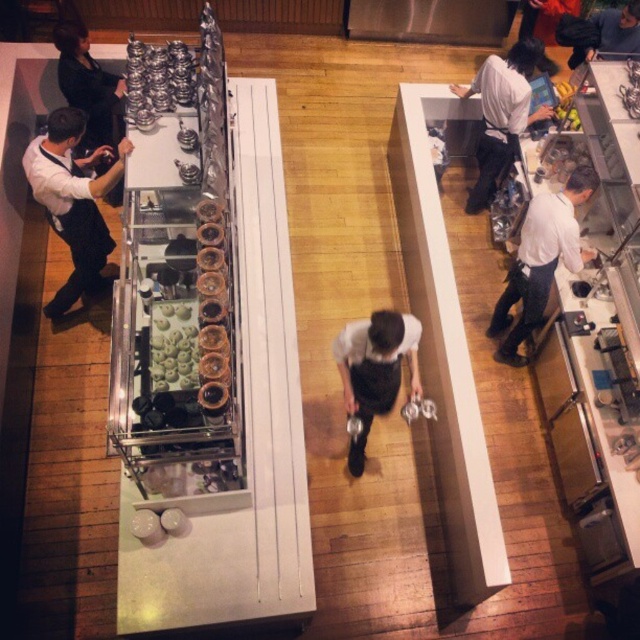
Does point (566, 259) come behind point (529, 61)?

No, (566, 259) is closer to viewer.

Is white shirt at right taller than white apron at right?

Yes, white shirt at right is taller than white apron at right.

Who is more distant from viewer, (531, 230) or (488, 80)?

The point (488, 80) is more distant.

You are a GUI agent. You are given a task and a screenshot of the screen. Output one action in this format:
    pyautogui.click(x=<x>, y=<y>)
    Task: Click on the white shirt at right
    The image size is (640, 640).
    Given the screenshot: What is the action you would take?
    pyautogui.click(x=540, y=260)

Can you confirm if white shirt at right is bigger than dark blue sweater at upper right?

Yes.

Does white shirt at right appear under dark blue sweater at upper right?

Yes.

Is point (529, 225) positioned in front of point (589, 29)?

Yes, point (529, 225) is closer to viewer.

You are a GUI agent. You are given a task and a screenshot of the screen. Output one action in this format:
    pyautogui.click(x=<x>, y=<y>)
    Task: Click on the white shirt at right
    
    Given the screenshot: What is the action you would take?
    pyautogui.click(x=540, y=260)

Is point (566, 252) behind point (380, 362)?

Yes, it is.

Is point (573, 256) positioned in front of point (385, 342)?

No, (573, 256) is behind (385, 342).

Between point (532, 305) and point (410, 346), which one is positioned in front?

Point (410, 346) is more forward.

This screenshot has width=640, height=640. Identify the location of white shirt at right. (540, 260).